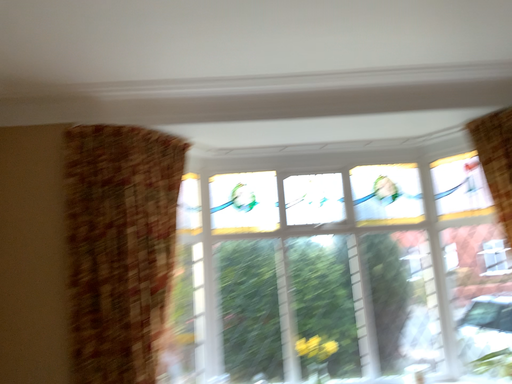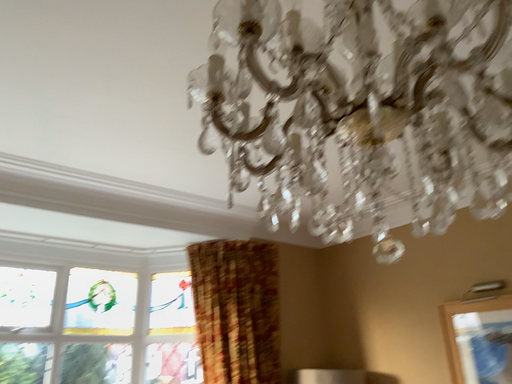
Question: Which way did the camera rotate in the video?

Choices:
 (A) rotated right
 (B) rotated left

Answer: (A)